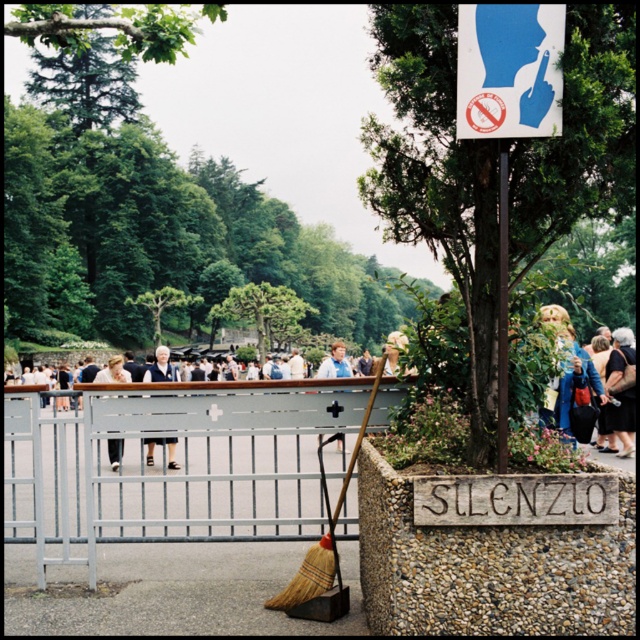
Does brushed metal fence at center have a greater width compared to dark blue fabric coat at center?

Indeed, brushed metal fence at center has a greater width compared to dark blue fabric coat at center.

Can you confirm if brushed metal fence at center is thinner than dark blue fabric coat at center?

No, brushed metal fence at center is not thinner than dark blue fabric coat at center.

The image size is (640, 640). I want to click on brushed metal fence at center, so click(168, 468).

Find the location of a particular element. The height and width of the screenshot is (640, 640). brushed metal fence at center is located at coordinates (168, 468).

Between blue plastic sign at upper center and black leather jacket at center, which one has more height?

black leather jacket at center is taller.

Is blue plastic sign at upper center above black leather jacket at center?

Correct, blue plastic sign at upper center is located above black leather jacket at center.

Image resolution: width=640 pixels, height=640 pixels. Identify the location of blue plastic sign at upper center. (509, 68).

Is blue plastic sign at upper center smaller than golden textured hair at center?

Yes.

Locate an element on the screen. This screenshot has width=640, height=640. blue plastic sign at upper center is located at coordinates (509, 68).